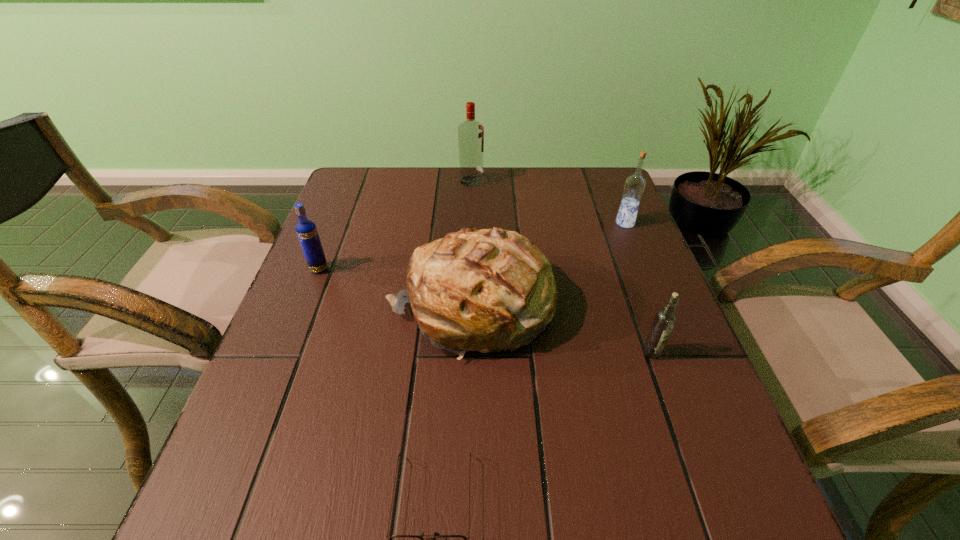
Locate an element on the screen. The height and width of the screenshot is (540, 960). free space located 0.100m on the front of the rightmost object is located at coordinates (637, 254).

Locate an element on the screen. The height and width of the screenshot is (540, 960). vacant space situated 0.100m on the right of the bread is located at coordinates (599, 307).

Where is `vacant space situated 0.120m on the back of the third farthest vodka`? The width and height of the screenshot is (960, 540). vacant space situated 0.120m on the back of the third farthest vodka is located at coordinates (334, 232).

In order to click on free space located 0.170m on the label of the second vodka from right to left in this screenshot , I will do `click(684, 446)`.

I want to click on object situated at the far edge, so click(x=470, y=133).

This screenshot has width=960, height=540. In order to click on object that is at the left edge in this screenshot , I will do `click(306, 230)`.

Where is `free region at the far edge of the desktop`? The width and height of the screenshot is (960, 540). free region at the far edge of the desktop is located at coordinates (468, 198).

The width and height of the screenshot is (960, 540). I want to click on free space at the left edge of the desktop, so click(283, 449).

Locate an element on the screen. Image resolution: width=960 pixels, height=540 pixels. vacant space at the right edge of the desktop is located at coordinates (613, 218).

In the image, there is a desktop. Where is `vacant space at the near left corner`? The height and width of the screenshot is (540, 960). vacant space at the near left corner is located at coordinates (226, 487).